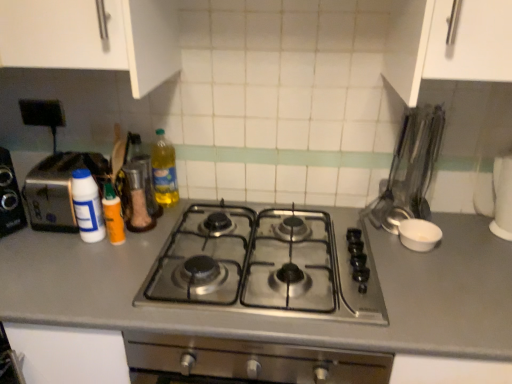
The height and width of the screenshot is (384, 512). What are the coordinates of `free space in front of translucent plastic bottle at center, the 3th bottle viewed from the left` in the screenshot? It's located at (152, 228).